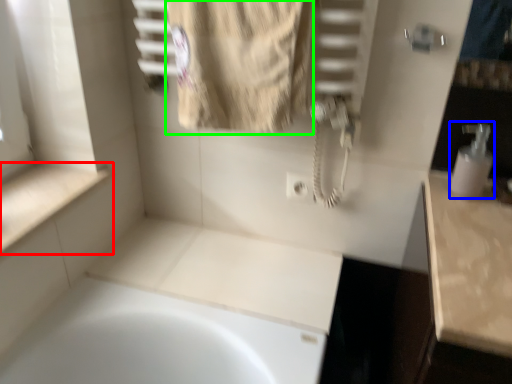
Question: Which is farther away from counter top (highlighted by a red box)? soap dispenser (highlighted by a blue box) or bath towel (highlighted by a green box)?

Choices:
 (A) soap dispenser
 (B) bath towel

Answer: (A)